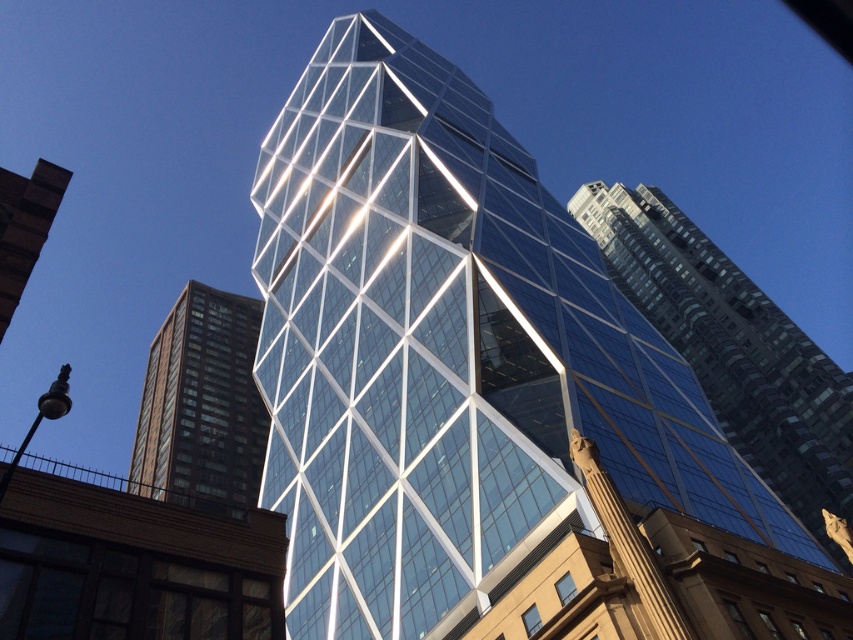
Is transparent glass skyscraper at center below brown glass building at left?

No.

How far apart are transparent glass skyscraper at center and brown glass building at left?

The distance of transparent glass skyscraper at center from brown glass building at left is 104.08 meters.

Which is behind, point (846, 372) or point (186, 339)?

The point (186, 339) is behind.

In order to click on transparent glass skyscraper at center in this screenshot , I will do `click(732, 348)`.

Describe the element at coordinates (479, 381) in the screenshot. The width and height of the screenshot is (853, 640). I see `transparent glass tower at center` at that location.

Who is higher up, transparent glass tower at center or brown glass building at left?

transparent glass tower at center is above.

Where is `transparent glass tower at center`? This screenshot has height=640, width=853. transparent glass tower at center is located at coordinates (479, 381).

Does transparent glass skyscraper at center have a lesser width compared to clear glass skyscraper at upper center?

No, transparent glass skyscraper at center is not thinner than clear glass skyscraper at upper center.

Is transparent glass skyscraper at center positioned behind clear glass skyscraper at upper center?

That is True.

What do you see at coordinates (732, 348) in the screenshot? I see `transparent glass skyscraper at center` at bounding box center [732, 348].

I want to click on transparent glass skyscraper at center, so click(732, 348).